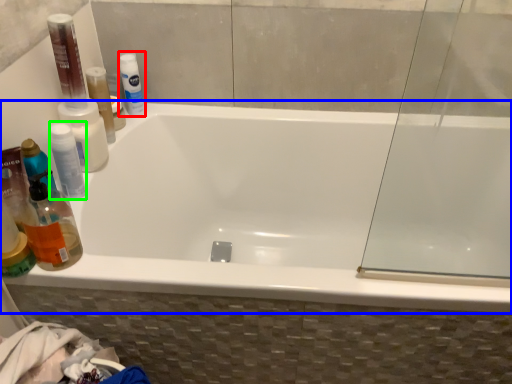
Question: Which is nearer to the mouthwash (highlighted by a red box)? bathtub (highlighted by a blue box) or mouthwash (highlighted by a green box).

Choices:
 (A) bathtub
 (B) mouthwash

Answer: (B)